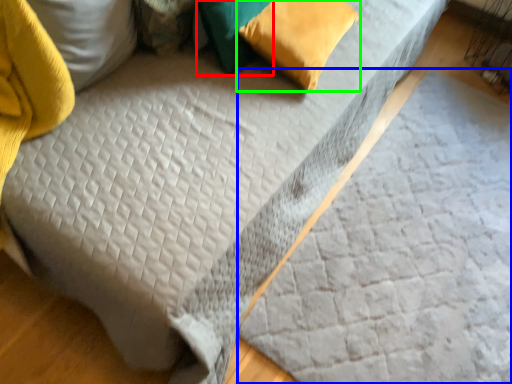
Question: Considering the real-world distances, which object is closest to pillow (highlighted by a red box)? sheet (highlighted by a blue box) or pillow (highlighted by a green box).

Choices:
 (A) sheet
 (B) pillow

Answer: (B)